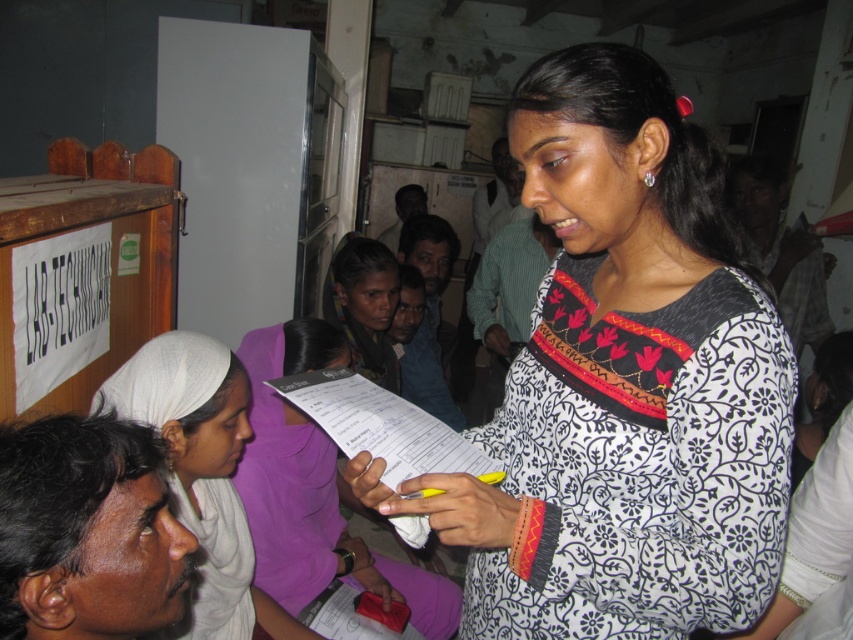
You are a photographer setting up for a group photo. You need to position the white fabric headscarf at left and the dark purple fabric at center so that they are both visible in the frame. Based on their current positions, which fabric is closer to the bottom of the image?

The white fabric headscarf at left is located below dark purple fabric at center, so it is closer to the bottom of the image.

You are organizing a fashion show and need to arrange the white fabric headscarf at left and the dark purple fabric at center based on their height. Which fabric should be placed first in the order of tallest to shortest?

The white fabric headscarf at left is taller than the dark purple fabric at center, so it should be placed first in the order of tallest to shortest.